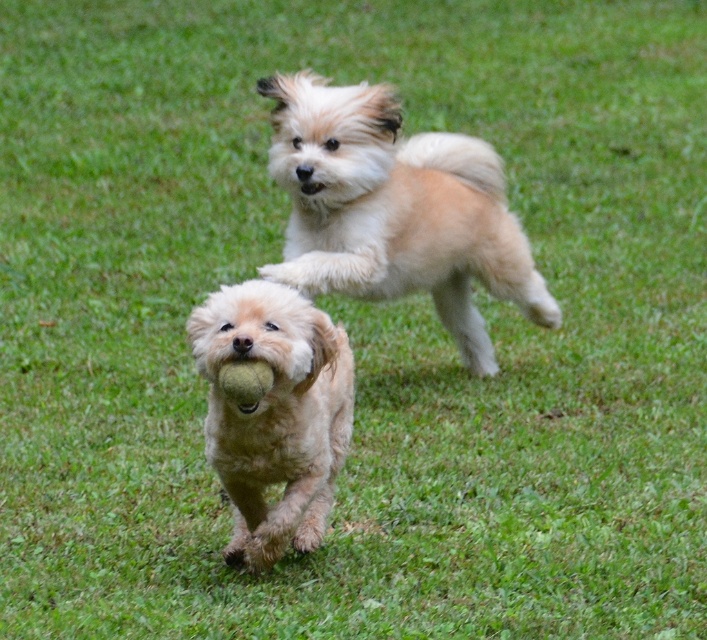
You are standing at the origin point in the image and want to walk towards the direction of the point labeled as point (395, 209). Which dog will you encounter first?

You will encounter the fuzzy beige dog at upper center first because the point (395, 209) indicates its location, so it is closer to your starting position at the origin.

You are standing in the grassy field and see two dogs. The first is the fuzzy beige dog at upper center, and the second is the fuzzy beige dog at center. Which dog is positioned more to the right side of the field?

The fuzzy beige dog at upper center is positioned more to the right side of the field compared to the fuzzy beige dog at center.

You are standing in the field and want to reach the point marked at coordinates point (542,291). If you can walk 1.5 meters per second, how long will it take you to reach there?

The point marked at coordinates point (542,291) is 5.76 meters away from the viewer. At a walking speed of 1.5 meters per second, it will take approximately 3.84 seconds to reach there.